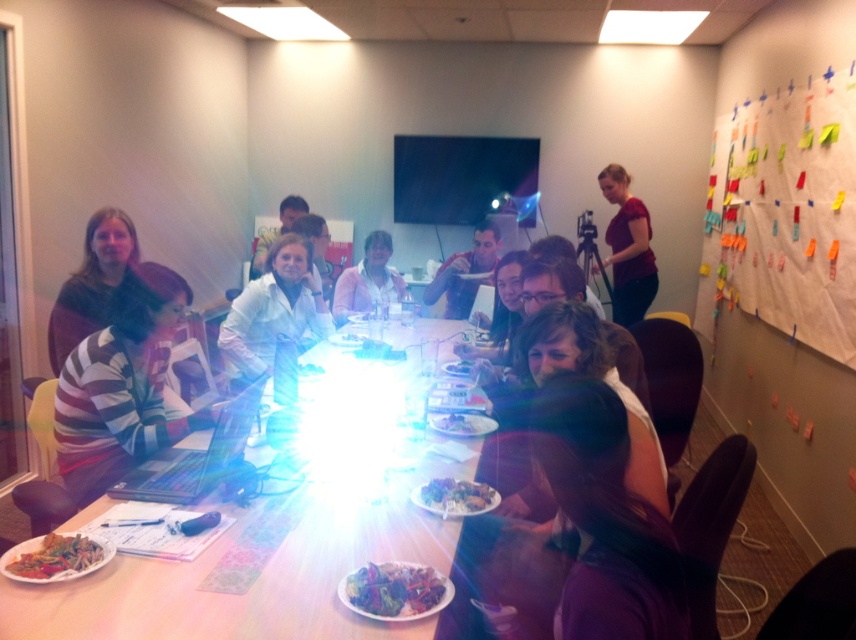
Does striped sweater at left appear on the right side of smooth white plate at center?

Incorrect, striped sweater at left is not on the right side of smooth white plate at center.

Is point (63, 326) more distant than point (461, 371)?

No, it is in front of (461, 371).

Where is `striped sweater at left`? Image resolution: width=856 pixels, height=640 pixels. striped sweater at left is located at coordinates (91, 282).

Does matte red shirt at upper right appear over shiny blue plate at center?

A: Yes, matte red shirt at upper right is above shiny blue plate at center.

Looking at this image, is matte red shirt at upper right smaller than shiny blue plate at center?

No.

Does point (642, 214) lie behind point (480, 504)?

That is True.

Locate an element on the screen. matte red shirt at upper right is located at coordinates (627, 248).

The height and width of the screenshot is (640, 856). Describe the element at coordinates (272, 312) in the screenshot. I see `white matte shirt at center` at that location.

Is point (248, 348) closer to viewer compared to point (449, 433)?

No.

Is point (250, 374) positioned behind point (462, 417)?

Yes, point (250, 374) is farther from viewer.

The height and width of the screenshot is (640, 856). I want to click on white matte shirt at center, so click(272, 312).